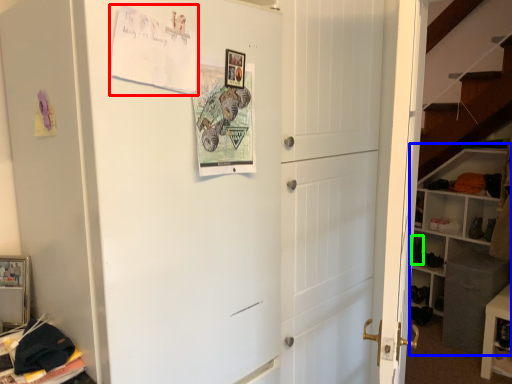
Question: Which is nearer to the postcard (highlighted by a red box)? bookshelf (highlighted by a blue box) or shoe (highlighted by a green box).

Choices:
 (A) bookshelf
 (B) shoe

Answer: (A)